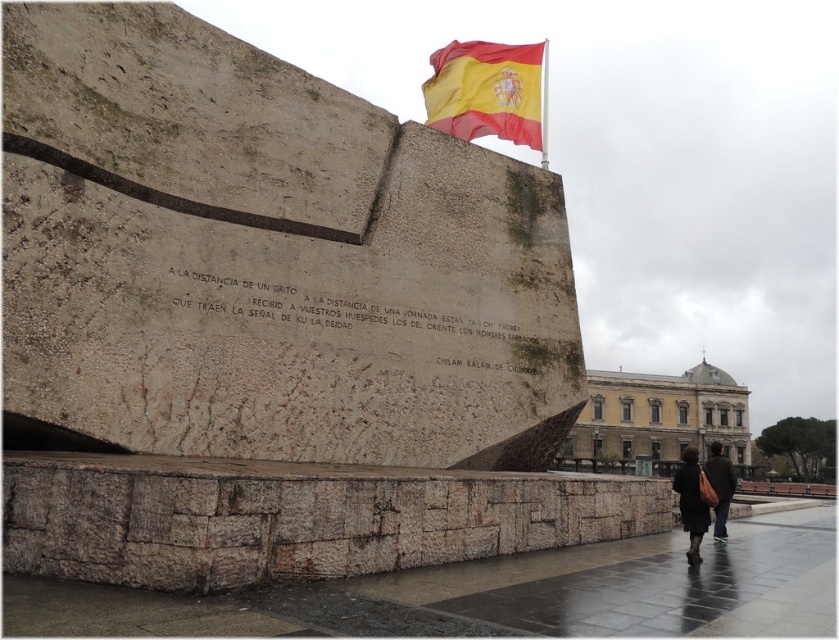
In the scene shown: Who is more distant from viewer, [696,448] or [722,525]?

The point [696,448] is behind.

From the picture: Can you confirm if dark brown leather coat at lower right is positioned below dark brown leather jacket at lower right?

Incorrect, dark brown leather coat at lower right is not positioned below dark brown leather jacket at lower right.

The height and width of the screenshot is (640, 839). Identify the location of dark brown leather coat at lower right. (691, 502).

Does red/yellow fabric flag at upper center have a smaller size compared to dark brown leather jacket at lower right?

Actually, red/yellow fabric flag at upper center might be larger than dark brown leather jacket at lower right.

Does point (468, 115) come farther from viewer compared to point (725, 515)?

Yes, it is behind point (725, 515).

Does point (462, 81) come farther from viewer compared to point (727, 477)?

Yes, point (462, 81) is farther from viewer.

What are the coordinates of `red/yellow fabric flag at upper center` in the screenshot? It's located at (487, 92).

Who is more forward, (493, 52) or (681, 515)?

Point (681, 515) is in front.

Does red/yellow fabric flag at upper center have a greater width compared to dark brown leather coat at lower right?

Incorrect, red/yellow fabric flag at upper center's width does not surpass dark brown leather coat at lower right's.

The width and height of the screenshot is (839, 640). Describe the element at coordinates (487, 92) in the screenshot. I see `red/yellow fabric flag at upper center` at that location.

I want to click on red/yellow fabric flag at upper center, so click(487, 92).